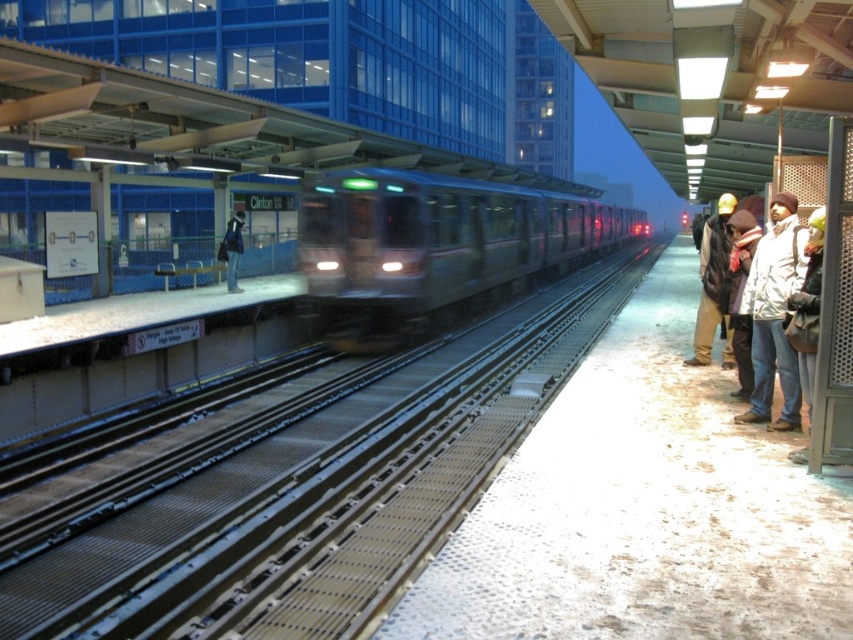
You are a delivery robot with a 1.2 meter wide package. You need to move from the brown woolen hat at right to the dark blue jacket at center. Is there enough space between them for your package?

The distance between the brown woolen hat at right and the dark blue jacket at center is 12.71 meters, so yes, the delivery robot can move the 1.2 meter wide package between them since the space is sufficient.

You are standing on the Clinton subway platform and see a metallic silver train at center and a dark blue jacket at center. Which object is closer to the train tracks?

The metallic silver train at center is closer to the train tracks because it is positioned to the right of the dark blue jacket at center, which is on the platform side.